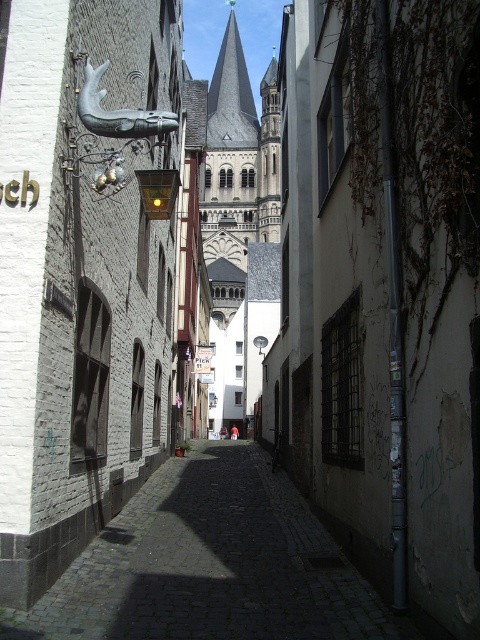
Is point (452, 188) positioned in front of point (332, 625)?

Yes, point (452, 188) is in front of point (332, 625).

How much distance is there between smooth concrete wall at center and cobblestone street at center?

They are 13.61 meters apart.

Between point (468, 538) and point (406, 627), which one is positioned in front?

Point (468, 538)

You are a GUI agent. You are given a task and a screenshot of the screen. Output one action in this format:
    pyautogui.click(x=<x>, y=<y>)
    Task: Click on the smooth concrete wall at center
    The image size is (480, 640).
    Given the screenshot: What is the action you would take?
    pyautogui.click(x=384, y=291)